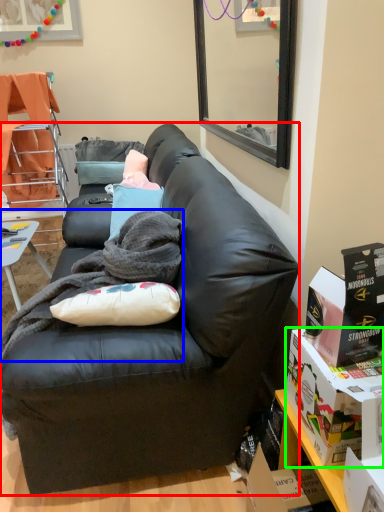
Question: Considering the real-world distances, which object is closest to studio couch (highlighted by a red box)? blanket (highlighted by a blue box) or box (highlighted by a green box).

Choices:
 (A) blanket
 (B) box

Answer: (A)